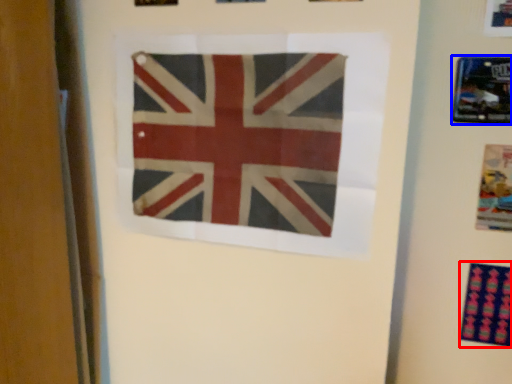
Question: Which of the following is the closest to the observer, print (highlighted by a red box) or picture frame (highlighted by a blue box)?

Choices:
 (A) print
 (B) picture frame

Answer: (B)